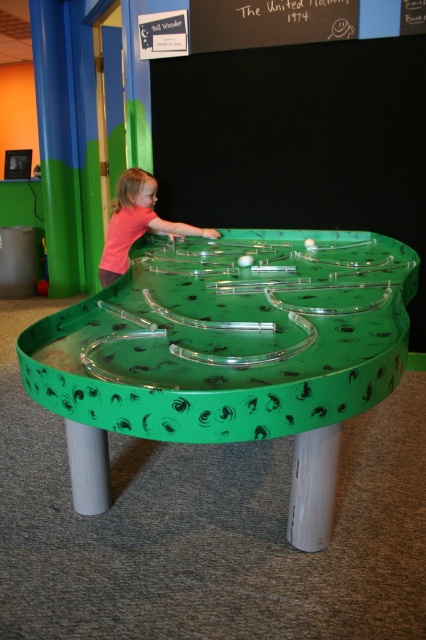
You are a parent trying to guide your child to the green glossy table at center. From your perspective, which side of the pink matte shirt at upper left should you direct them to walk towards?

The green glossy table at center is positioned on the right side of pink matte shirt at upper left, so you should direct them to walk towards the right side of the pink matte shirt at upper left.

You are a visitor at the Ball Wonder exhibit and see the green glossy table at center and the pink matte shirt at upper left. Which object is positioned higher up in the image?

The pink matte shirt at upper left is positioned higher up in the image than the green glossy table at center.